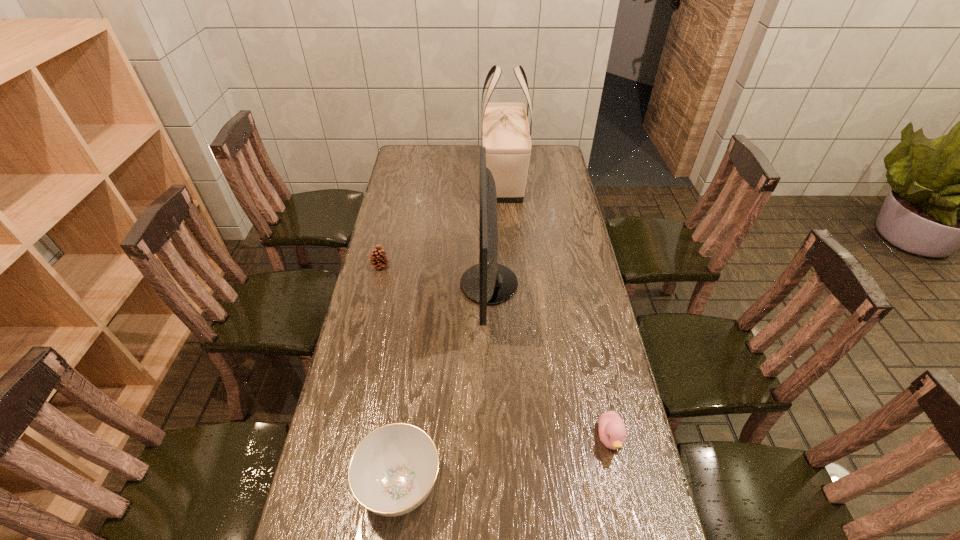
Find the location of a particular element. vacant space that's between the leftmost object and the farthest object is located at coordinates (442, 223).

Find the location of a particular element. The image size is (960, 540). free space that is in between the chinaware and the duckling is located at coordinates (505, 462).

Identify the location of free spot between the shopping bag and the duckling. This screenshot has width=960, height=540. (557, 309).

Find the location of `vacant point located between the duckling and the monitor`. vacant point located between the duckling and the monitor is located at coordinates tap(550, 361).

Identify the location of unoccupied area between the duckling and the leftmost object. The width and height of the screenshot is (960, 540). (495, 352).

At what (x,y) coordinates should I click in order to perform the action: click on vacant region between the pinecone and the second tallest object. Please return your answer as a coordinate pair (x, y). Looking at the image, I should click on point(435,275).

I want to click on free space that is in between the farthest object and the chinaware, so click(451, 332).

Image resolution: width=960 pixels, height=540 pixels. What are the coordinates of `free area in between the tallest object and the leftmost object` in the screenshot? It's located at (442, 223).

Locate an element on the screen. free space between the tallest object and the leftmost object is located at coordinates (442, 223).

Where is `vacant area that lies between the pinecone and the chinaware`? vacant area that lies between the pinecone and the chinaware is located at coordinates (390, 375).